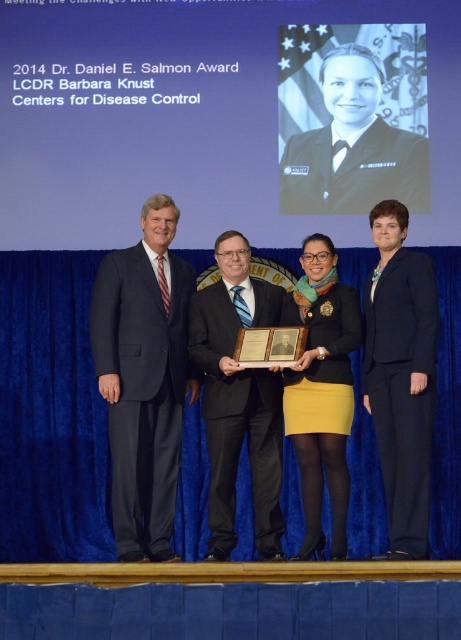
Can you confirm if dark blue suit at left is positioned above black suit at right?

Yes.

Between point (163, 262) and point (371, 337), which one is positioned behind?

The point (163, 262) is more distant.

The width and height of the screenshot is (461, 640). In order to click on dark blue suit at left in this screenshot , I will do `click(143, 378)`.

What do you see at coordinates (238, 400) in the screenshot? I see `black suit at center` at bounding box center [238, 400].

At what (x,y) coordinates should I click in order to perform the action: click on black suit at center. Please return your answer as a coordinate pair (x, y). The image size is (461, 640). Looking at the image, I should click on (238, 400).

Is point (277, 435) positioned after point (319, 333)?

No, it is in front of (319, 333).

You are a GUI agent. You are given a task and a screenshot of the screen. Output one action in this format:
    pyautogui.click(x=<x>, y=<y>)
    Task: Click on the black suit at center
    The image size is (461, 640).
    Given the screenshot: What is the action you would take?
    pyautogui.click(x=238, y=400)

Does dark blue suit at left have a smaller size compared to black suit at center?

Actually, dark blue suit at left might be larger than black suit at center.

Does dark blue suit at left appear over black suit at center?

Indeed, dark blue suit at left is positioned over black suit at center.

Is point (135, 268) positioned after point (212, 417)?

Yes, point (135, 268) is farther from viewer.

Where is `dark blue suit at left`? dark blue suit at left is located at coordinates (143, 378).